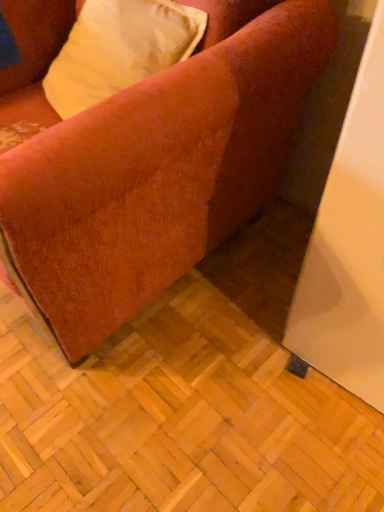
Question: Does velvet-like beige pillow at upper left have a lesser width compared to velvet-like orange couch at lower left?

Choices:
 (A) no
 (B) yes

Answer: (B)

Question: From a real-world perspective, is velvet-like beige pillow at upper left positioned under velvet-like orange couch at lower left based on gravity?

Choices:
 (A) yes
 (B) no

Answer: (B)

Question: Can you confirm if velvet-like beige pillow at upper left is wider than velvet-like orange couch at lower left?

Choices:
 (A) no
 (B) yes

Answer: (A)

Question: Can you confirm if velvet-like beige pillow at upper left is positioned to the left of velvet-like orange couch at lower left?

Choices:
 (A) yes
 (B) no

Answer: (B)

Question: Can you confirm if velvet-like beige pillow at upper left is bigger than velvet-like orange couch at lower left?

Choices:
 (A) yes
 (B) no

Answer: (B)

Question: From the image's perspective, does velvet-like beige pillow at upper left appear higher than velvet-like orange couch at lower left?

Choices:
 (A) no
 (B) yes

Answer: (B)

Question: Can you confirm if velvet-like orange couch at lower left is shorter than velvet-like beige pillow at upper left?

Choices:
 (A) yes
 (B) no

Answer: (B)

Question: Does velvet-like orange couch at lower left have a larger size compared to velvet-like beige pillow at upper left?

Choices:
 (A) yes
 (B) no

Answer: (A)

Question: From a real-world perspective, is velvet-like orange couch at lower left physically above velvet-like beige pillow at upper left?

Choices:
 (A) no
 (B) yes

Answer: (A)

Question: Is velvet-like orange couch at lower left thinner than velvet-like beige pillow at upper left?

Choices:
 (A) no
 (B) yes

Answer: (A)

Question: From the image's perspective, is velvet-like orange couch at lower left above velvet-like beige pillow at upper left?

Choices:
 (A) no
 (B) yes

Answer: (A)

Question: From a real-world perspective, is velvet-like orange couch at lower left below velvet-like beige pillow at upper left?

Choices:
 (A) no
 (B) yes

Answer: (B)

Question: From a real-world perspective, is velvet-like beige pillow at upper left positioned above or below velvet-like orange couch at lower left?

Choices:
 (A) above
 (B) below

Answer: (A)